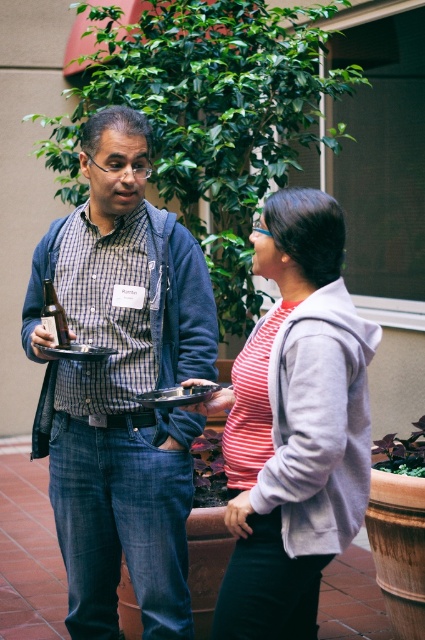
You are standing in the courtyard and want to walk from point (164, 436) to point (376, 330). Which direction should you move in to get closer to your destination?

You should move backward because point (164, 436) is closer to you than point (376, 330), so moving away from the viewer would bring you closer to the destination.

You are a photographer trying to capture a candid shot of the two people in the scene. You need to ensure that both the matte blue jeans at center and the striped cotton shirt at center are clearly visible in the frame. Given their relative sizes, which object should you focus on to ensure both are in focus?

The matte blue jeans at center has a greater height compared to the striped cotton shirt at center. To ensure both are in focus, you should focus on the matte blue jeans at center since it is taller and will require the camera to adjust for its size, thereby keeping the striped cotton shirt at center in focus as well.